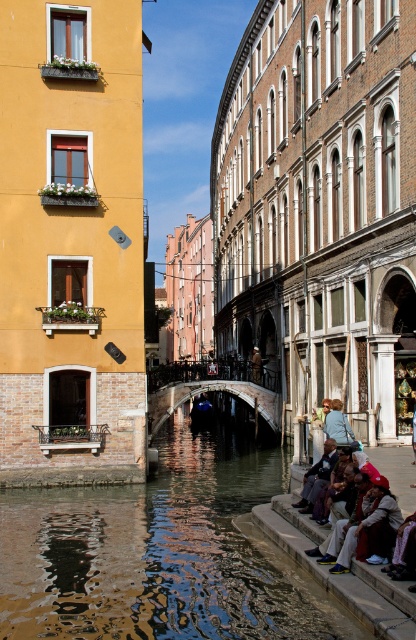
You are standing at the edge of the canal in Venice and want to determine which of the two points, point (259,520) or point (332,412), is closer to you. Based on the scene, can you tell which point is nearer?

Point (259,520) is closer to the viewer than point (332,412).

In the scene shown: You are standing at the edge of the canal and need to place a small potted plant on the smooth stone ledge at lower right or the light blue fabric jacket at lower right. Which surface has enough space to accommodate the plant without overlapping?

The smooth stone ledge at lower right has a greater width than the light blue fabric jacket at lower right, so the plant can be placed on the smooth stone ledge at lower right without overlapping.

In the scene shown: You are standing at the edge of a Venetian canal and notice two items at the lower right corner of the scene. The smooth stone ledge at lower right and the light blue fabric jacket at lower right. Which one is positioned to the left side?

The smooth stone ledge at lower right is positioned to the left of the light blue fabric jacket at lower right according to the description.